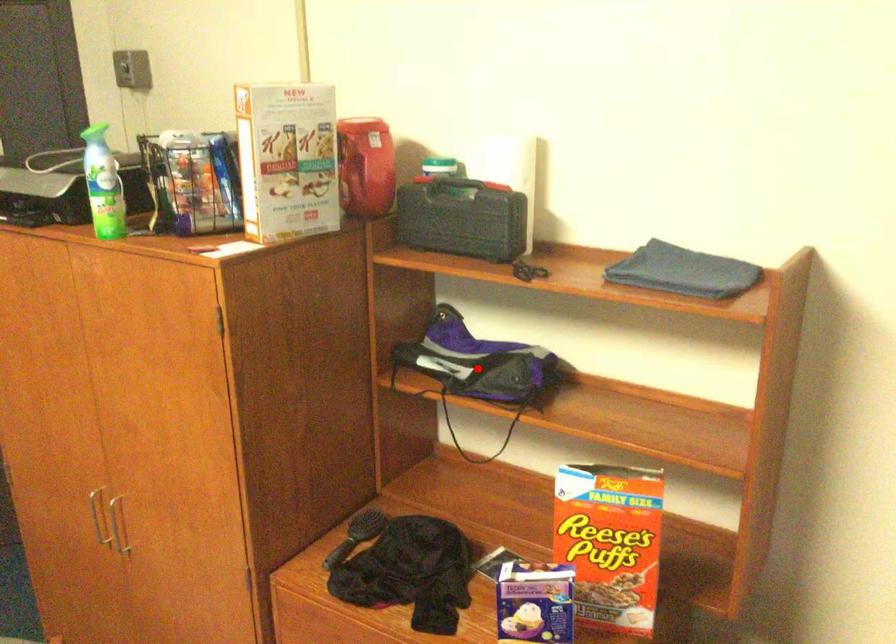
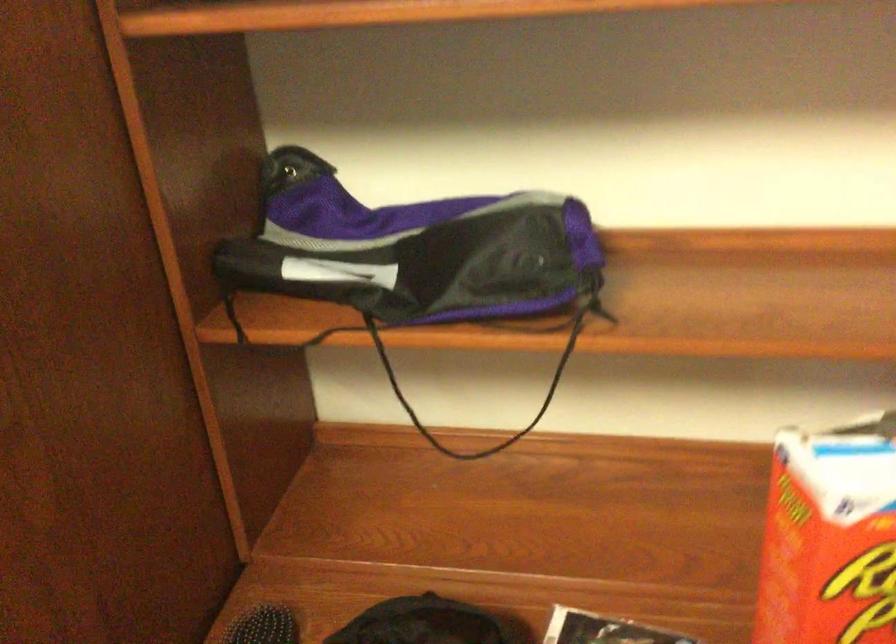
Question: I am providing you with two images of the same scene from different viewpoints. Given a red point in image1, look at the same physical point in image2. Is it:

Choices:
 (A) Closer to the viewpoint
 (B) Farther from the viewpoint

Answer: (A)